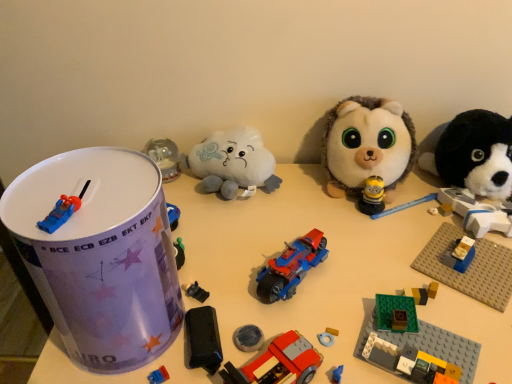
Identify the location of vacant space that is to the left of fluffy white plush at center, the 2th toy viewed from the right. The width and height of the screenshot is (512, 384). click(x=282, y=205).